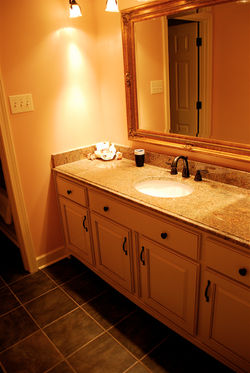
The height and width of the screenshot is (373, 250). I want to click on hallway, so click(7, 249).